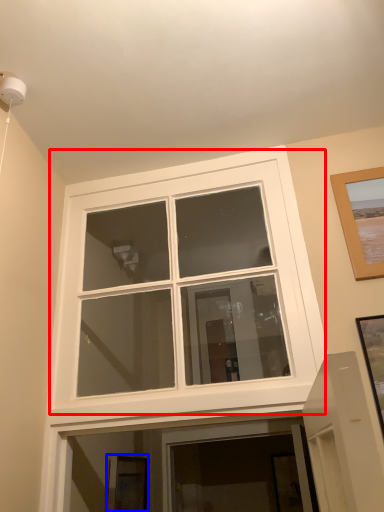
Question: Among these objects, which one is nearest to the camera, window (highlighted by a red box) or picture frame (highlighted by a blue box)?

Choices:
 (A) window
 (B) picture frame

Answer: (A)